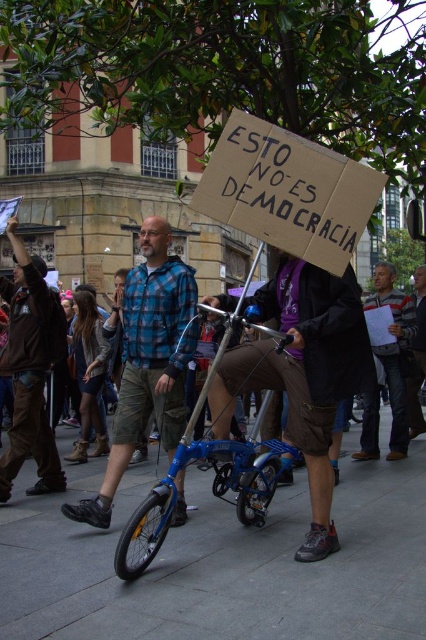
Can you confirm if blue plaid shirt at center is positioned above brown leather jacket at left?

No, blue plaid shirt at center is not above brown leather jacket at left.

How much distance is there between blue plaid shirt at center and brown leather jacket at left?

They are 5.10 meters apart.

Locate an element on the screen. This screenshot has height=640, width=426. blue plaid shirt at center is located at coordinates (147, 362).

Is blue plaid shirt at center below dark gray jeans at center?

Yes, blue plaid shirt at center is below dark gray jeans at center.

Does blue plaid shirt at center have a greater height compared to dark gray jeans at center?

Indeed, blue plaid shirt at center has a greater height compared to dark gray jeans at center.

Who is more distant from viewer, (150, 371) or (376, 428)?

Positioned behind is point (376, 428).

Identify the location of blue plaid shirt at center. The height and width of the screenshot is (640, 426). (147, 362).

Is slate gray pavement at lower center below blue plaid shirt at center?

Yes.

Is slate gray pavement at lower center thinner than blue plaid shirt at center?

No.

The image size is (426, 640). What do you see at coordinates (222, 564) in the screenshot?
I see `slate gray pavement at lower center` at bounding box center [222, 564].

You are a GUI agent. You are given a task and a screenshot of the screen. Output one action in this format:
    pyautogui.click(x=<x>, y=<y>)
    Task: Click on the slate gray pavement at lower center
    The image size is (426, 640).
    Given the screenshot: What is the action you would take?
    pyautogui.click(x=222, y=564)